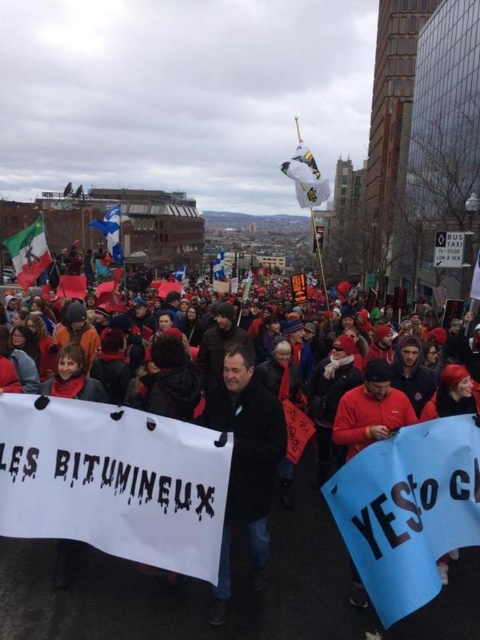
Question: Can you confirm if white fabric flag at upper center is bigger than white fabric flag at center?

Choices:
 (A) yes
 (B) no

Answer: (A)

Question: Does black matte coat at center appear under white fabric flag at upper center?

Choices:
 (A) yes
 (B) no

Answer: (A)

Question: Considering the real-world distances, which object is farthest from the black matte coat at center?

Choices:
 (A) white fabric flag at center
 (B) matte plastic flag at left
 (C) white paper banner at center

Answer: (A)

Question: Which is nearer to the white fabric flag at upper center?

Choices:
 (A) white fabric flag at center
 (B) matte plastic flag at left
 (C) blue fabric flag at upper center
 (D) black matte coat at center

Answer: (D)

Question: Does matte plastic flag at left appear on the right side of white fabric flag at upper center?

Choices:
 (A) yes
 (B) no

Answer: (B)

Question: Which of the following is the farthest from the observer?

Choices:
 (A) (218, 253)
 (B) (11, 237)
 (C) (115, 221)

Answer: (A)